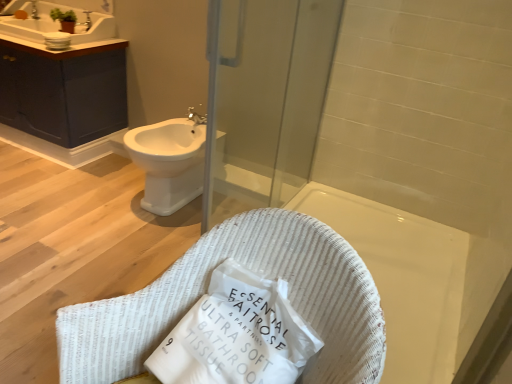
Question: From the image's perspective, would you say white woven basket at center is positioned over white glossy bidet at center left?

Choices:
 (A) no
 (B) yes

Answer: (A)

Question: Could you tell me if white woven basket at center is turned towards white glossy bidet at center left?

Choices:
 (A) yes
 (B) no

Answer: (B)

Question: Is white woven basket at center smaller than white glossy bidet at center left?

Choices:
 (A) yes
 (B) no

Answer: (B)

Question: From the image's perspective, does white woven basket at center appear lower than white glossy bidet at center left?

Choices:
 (A) yes
 (B) no

Answer: (A)

Question: Is white woven basket at center looking in the opposite direction of white glossy bidet at center left?

Choices:
 (A) yes
 (B) no

Answer: (B)

Question: Would you say white woven basket at center is outside white glossy bidet at center left?

Choices:
 (A) no
 (B) yes

Answer: (B)

Question: Is white glossy bidet at center left located within silver metallic faucet at upper left, marked as the first faucet in a front-to-back arrangement?

Choices:
 (A) no
 (B) yes

Answer: (A)

Question: Does silver metallic faucet at upper left, marked as the first faucet in a front-to-back arrangement, come in front of white glossy bidet at center left?

Choices:
 (A) no
 (B) yes

Answer: (A)

Question: Is silver metallic faucet at upper left, positioned as the second faucet in top-to-bottom order, positioned beyond the bounds of white glossy bidet at center left?

Choices:
 (A) yes
 (B) no

Answer: (A)

Question: Is silver metallic faucet at upper left, positioned as the second faucet in top-to-bottom order, to the left of white glossy bidet at center left from the viewer's perspective?

Choices:
 (A) no
 (B) yes

Answer: (B)

Question: Considering the relative sizes of silver metallic faucet at upper left, the first faucet viewed from the right, and white glossy bidet at center left in the image provided, is silver metallic faucet at upper left, the first faucet viewed from the right, taller than white glossy bidet at center left?

Choices:
 (A) yes
 (B) no

Answer: (B)

Question: Is silver metallic faucet at upper left, the first faucet from the bottom, beside white glossy bidet at center left?

Choices:
 (A) yes
 (B) no

Answer: (B)

Question: Is white woven basket at center located within silver metallic faucet at upper left, arranged as the 2th faucet when viewed from the back?

Choices:
 (A) no
 (B) yes

Answer: (A)